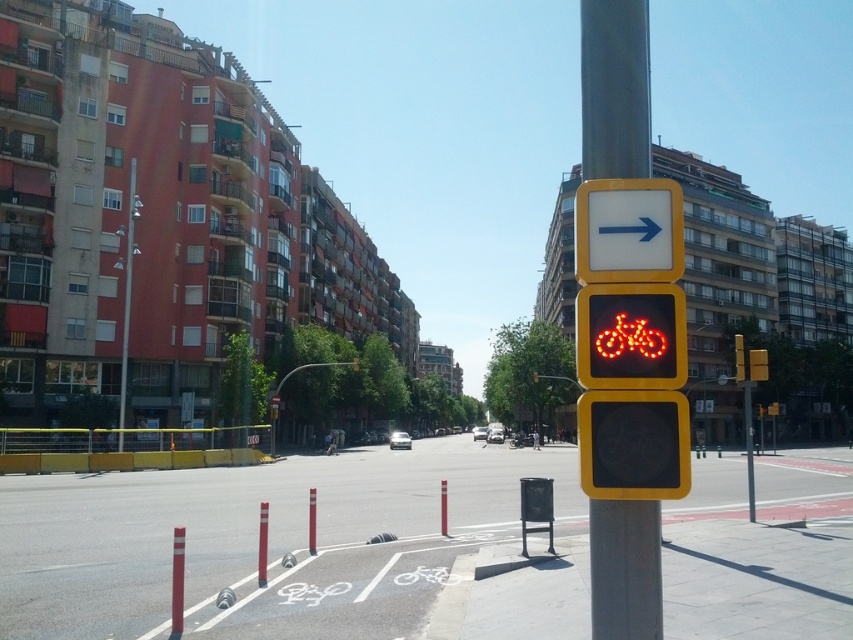
Image resolution: width=853 pixels, height=640 pixels. What do you see at coordinates (630, 337) in the screenshot?
I see `led illuminated bicycle at right` at bounding box center [630, 337].

Does point (589, 376) come farther from viewer compared to point (602, 196)?

No, it is in front of (602, 196).

Which is in front, point (587, 307) or point (577, 275)?

Point (587, 307) is more forward.

At what (x,y) coordinates should I click in order to perform the action: click on led illuminated bicycle at right. Please return your answer as a coordinate pair (x, y). The height and width of the screenshot is (640, 853). Looking at the image, I should click on (630, 337).

Which is behind, point (625, 552) or point (126, 296)?

The point (126, 296) is behind.

Which is more to the left, yellow plastic pole at right or metallic pole at left?

metallic pole at left is more to the left.

Does point (631, 161) come closer to viewer compared to point (129, 252)?

Yes, it is in front of point (129, 252).

You are a GUI agent. You are given a task and a screenshot of the screen. Output one action in this format:
    pyautogui.click(x=<x>, y=<y>)
    Task: Click on the yellow plastic pole at right
    The height and width of the screenshot is (640, 853).
    Given the screenshot: What is the action you would take?
    pyautogui.click(x=614, y=88)

I want to click on yellow plastic pole at right, so click(614, 88).

Can you confirm if yellow plastic pole at right is positioned below led illuminated bicycle at right?

Indeed, yellow plastic pole at right is positioned under led illuminated bicycle at right.

Describe the element at coordinates (614, 88) in the screenshot. This screenshot has width=853, height=640. I see `yellow plastic pole at right` at that location.

Find the location of a particular element. The image size is (853, 640). yellow plastic pole at right is located at coordinates (614, 88).